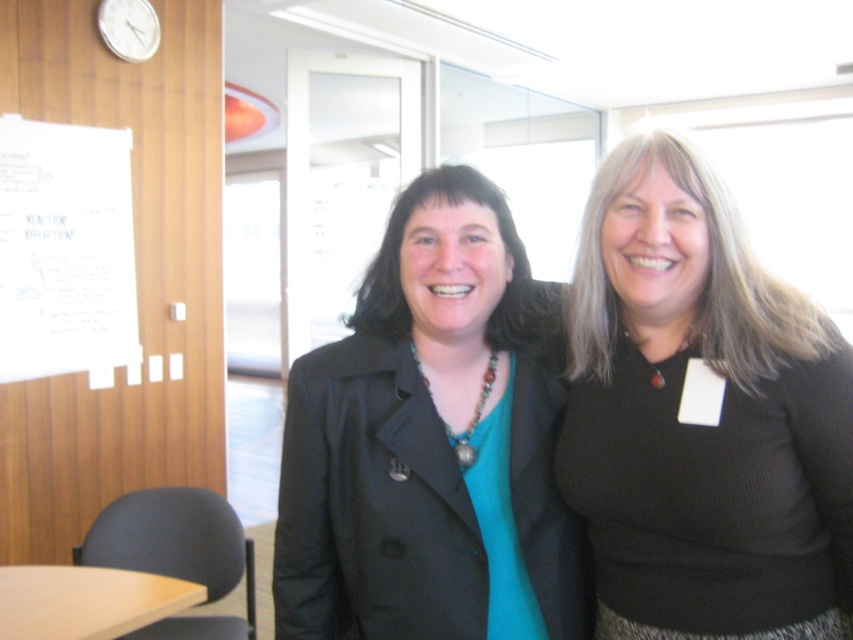
Is black ribbed sweater at right thinner than matte black jacket at center?

Yes, black ribbed sweater at right is thinner than matte black jacket at center.

Between black ribbed sweater at right and matte black jacket at center, which one is positioned lower?

matte black jacket at center

Find the location of a particular element. This screenshot has height=640, width=853. black ribbed sweater at right is located at coordinates (701, 417).

Based on the photo, is matte black jacket at center above white paper at upper left?

No.

Where is `matte black jacket at center`? matte black jacket at center is located at coordinates (431, 442).

Is point (526, 310) more distant than point (90, 182)?

No, it is in front of (90, 182).

Identify the location of matte black jacket at center. This screenshot has width=853, height=640. (431, 442).

Can you confirm if black ribbed sweater at right is shorter than white paper at upper left?

Correct, black ribbed sweater at right is not as tall as white paper at upper left.

Can you confirm if black ribbed sweater at right is positioned to the left of white paper at upper left?

No, black ribbed sweater at right is not to the left of white paper at upper left.

Between point (788, 561) and point (91, 160), which one is positioned in front?

Point (788, 561)

This screenshot has width=853, height=640. Identify the location of black ribbed sweater at right. (701, 417).